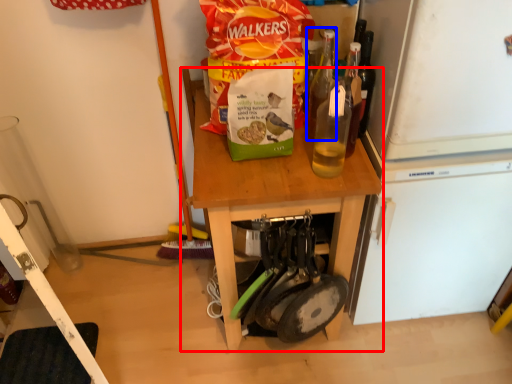
Question: Which object appears closest to the camera in this image, furniture (highlighted by a red box) or bottle (highlighted by a blue box)?

Choices:
 (A) furniture
 (B) bottle

Answer: (B)